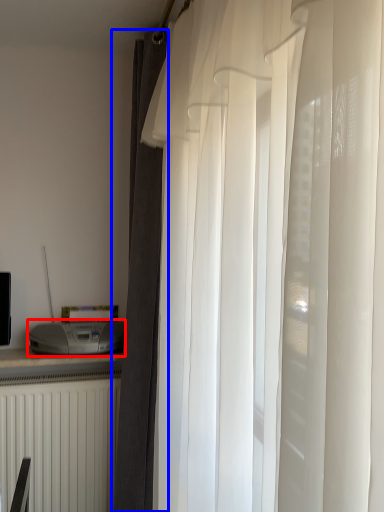
Question: Which of the following is the closest to the observer, appliance (highlighted by a red box) or curtain (highlighted by a blue box)?

Choices:
 (A) appliance
 (B) curtain

Answer: (B)